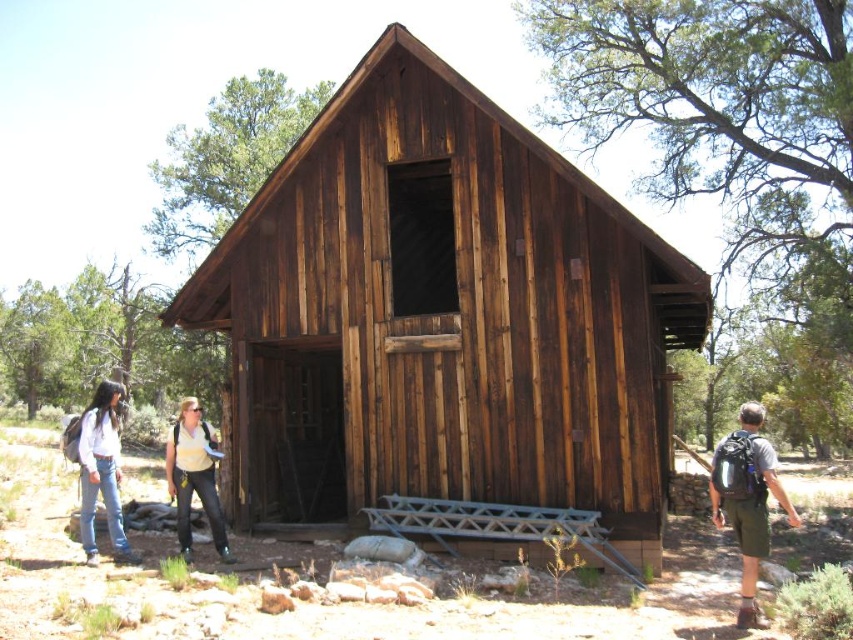
You are an observer standing in front of the cabin. You notice two items at the lower left corner of the scene. Which one is positioned more to the right between the denim pants at lower left and the denim jeans at lower left?

The denim pants at lower left is positioned more to the right compared to the denim jeans at lower left according to the description.